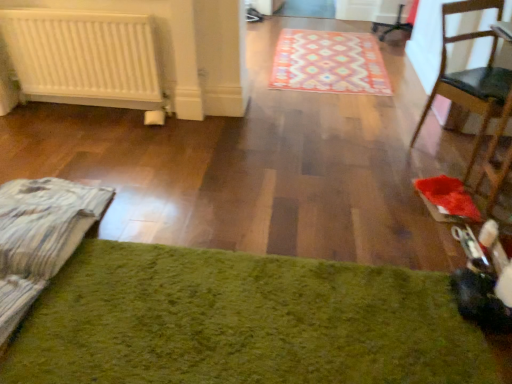
Question: Which direction should I rotate to look at green shaggy rug at lower center, which is the first mat from bottom to top?

Choices:
 (A) left
 (B) right

Answer: (A)

Question: Should I look upward or downward to see wooden chair at right?

Choices:
 (A) up
 (B) down

Answer: (A)

Question: Considering the relative positions of white matte radiator at left and patterned carpet at center, positioned as the 2th mat in bottom-to-top order, in the image provided, is white matte radiator at left to the right of patterned carpet at center, positioned as the 2th mat in bottom-to-top order, from the viewer's perspective?

Choices:
 (A) no
 (B) yes

Answer: (A)

Question: Is white matte radiator at left positioned in front of patterned carpet at center, the 1th mat from the top?

Choices:
 (A) yes
 (B) no

Answer: (A)

Question: From a real-world perspective, is white matte radiator at left beneath patterned carpet at center, positioned as the 2th mat in bottom-to-top order?

Choices:
 (A) yes
 (B) no

Answer: (B)

Question: From a real-world perspective, is white matte radiator at left positioned over patterned carpet at center, positioned as the 2th mat in bottom-to-top order, based on gravity?

Choices:
 (A) no
 (B) yes

Answer: (B)

Question: Can you confirm if white matte radiator at left is wider than patterned carpet at center, positioned as the 2th mat in bottom-to-top order?

Choices:
 (A) no
 (B) yes

Answer: (A)

Question: Is white matte radiator at left beside patterned carpet at center, which ranks as the second mat in front-to-back order?

Choices:
 (A) no
 (B) yes

Answer: (A)

Question: Is green shaggy rug at lower center, positioned as the 1th mat in front-to-back order, outside wooden chair at right?

Choices:
 (A) yes
 (B) no

Answer: (A)

Question: Can you confirm if green shaggy rug at lower center, the second mat in the back-to-front sequence, is positioned to the right of wooden chair at right?

Choices:
 (A) yes
 (B) no

Answer: (B)

Question: Could you tell me if green shaggy rug at lower center, which is the first mat from bottom to top, is facing wooden chair at right?

Choices:
 (A) yes
 (B) no

Answer: (B)

Question: Is green shaggy rug at lower center, positioned as the 1th mat in front-to-back order, further to the viewer compared to wooden chair at right?

Choices:
 (A) no
 (B) yes

Answer: (A)

Question: Is green shaggy rug at lower center, positioned as the 1th mat in front-to-back order, beside wooden chair at right?

Choices:
 (A) no
 (B) yes

Answer: (A)

Question: Is green shaggy rug at lower center, the second mat in the back-to-front sequence, positioned before wooden chair at right?

Choices:
 (A) yes
 (B) no

Answer: (A)

Question: From a real-world perspective, is patterned carpet at center, which ranks as the second mat in front-to-back order, physically above wooden chair at right?

Choices:
 (A) no
 (B) yes

Answer: (A)